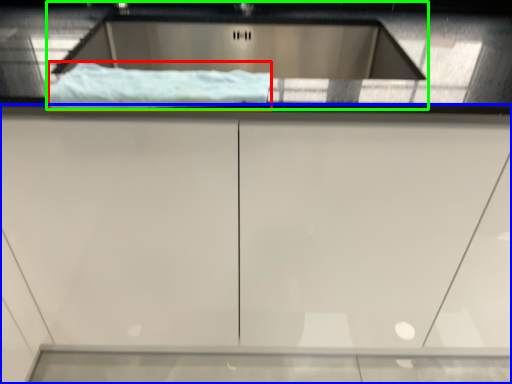
Question: Which is farther away from material (highlighted by a red box)? cabinetry (highlighted by a blue box) or sink (highlighted by a green box)?

Choices:
 (A) cabinetry
 (B) sink

Answer: (B)